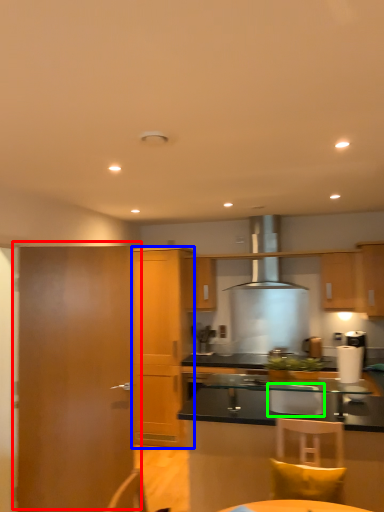
Question: Which object is the farthest from door (highlighted by a red box)? Choose among these: cabinetry (highlighted by a blue box) or armchair (highlighted by a green box).

Choices:
 (A) cabinetry
 (B) armchair

Answer: (A)